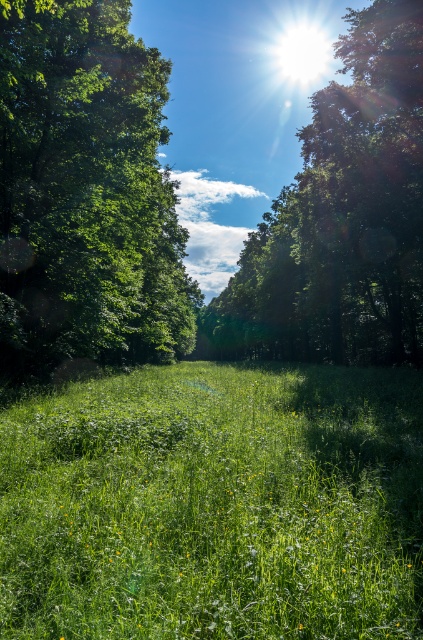
Based on the photo, you are standing in the meadow and want to walk towards the dense line of trees in the middle ground. You notice two points marked in the scene, point A at coordinates point A is point (340,595) and point B at coordinates point B is point (271,260). Which point would you reach first as you walk towards the trees?

Point A at coordinates point A is point (340,595) is closer to the camera than point B at coordinates point B is point (271,260), so you would reach point A first as you walk towards the trees.

You are an artist trying to paint the scene. You want to ensure the green leafy tree at left and the green leafy tree at upper center are proportionally accurate. Which tree should you paint smaller?

The green leafy tree at left should be painted smaller because it occupies less space than the green leafy tree at upper center.